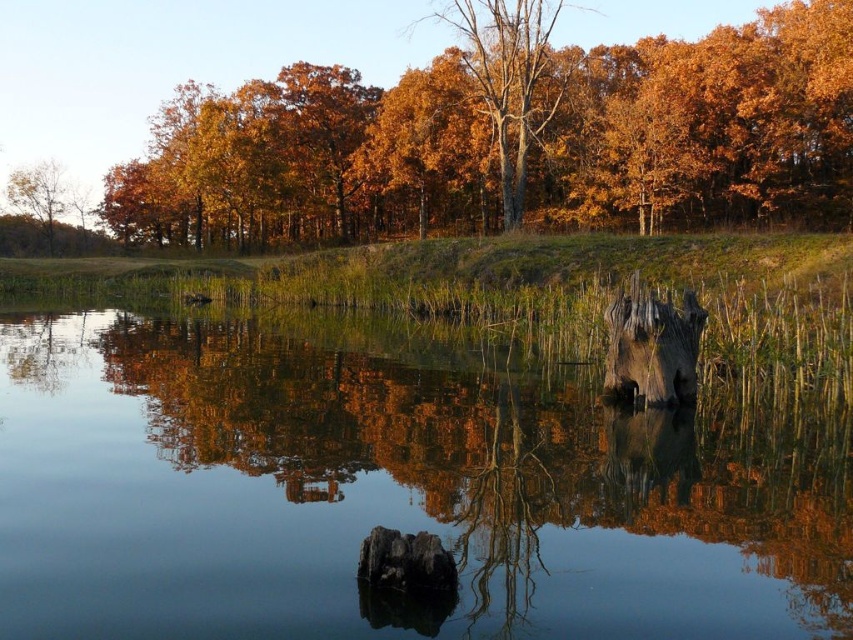
You are a landscape architect designing a walking path between the orange matte tree at upper center and the smooth brown tree trunk at upper left. The path must be straight and direct. How far apart are these two landmarks?

The orange matte tree at upper center is 26.54 meters away from the smooth brown tree trunk at upper left, so the path would need to be 26.54 meters long to connect them directly.

You are standing at the edge of the water and want to throw a pebble to create a ripple. The golden wood tree at center is in your way. Can you still hit the smooth water at center with your pebble?

The smooth water at center is 39.80 meters away from the golden wood tree at center. Since the tree is between you and the water, you can still hit the smooth water at center by aiming around or over the golden wood tree at center.

Looking at this image, you are an artist trying to paint this autumn scene. You want to ensure the smooth water at center and the smooth brown tree trunk at upper left are proportionally accurate. Which object should you paint as taller in your artwork?

The smooth brown tree trunk at upper left should be painted as taller because the smooth water at center has a lesser height compared to it.